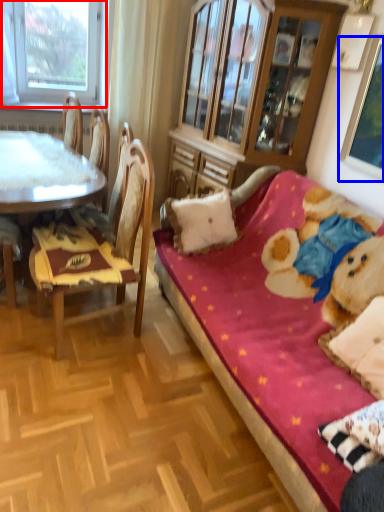
Question: Which of the following is the farthest to the observer, window (highlighted by a red box) or picture frame (highlighted by a blue box)?

Choices:
 (A) window
 (B) picture frame

Answer: (A)